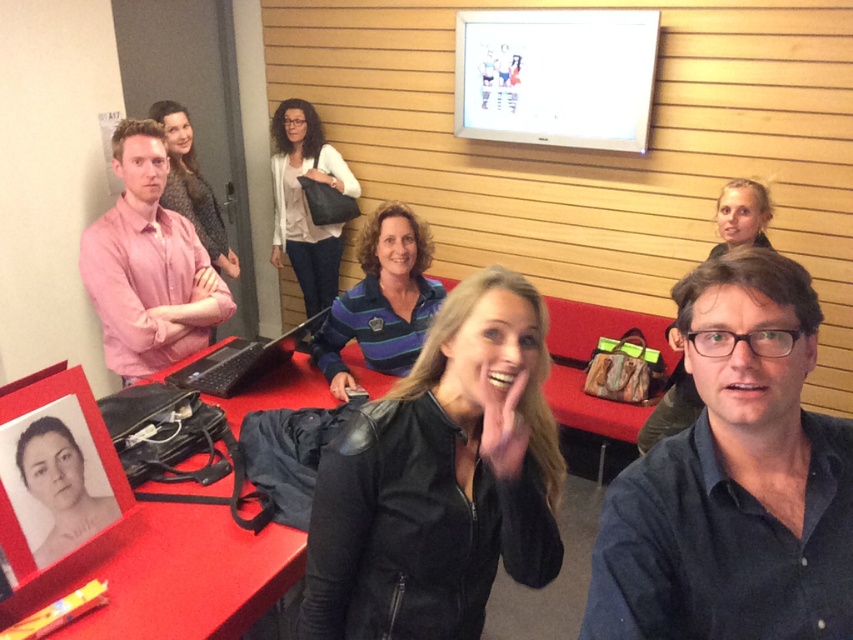
Does red leather table at center appear under matte pink sweater at center?

Yes, red leather table at center is below matte pink sweater at center.

Consider the image. Can you confirm if red leather table at center is wider than matte pink sweater at center?

Yes, red leather table at center is wider than matte pink sweater at center.

This screenshot has width=853, height=640. Identify the location of red leather table at center. (171, 576).

Is point (718, 216) farther from viewer compared to point (746, 196)?

Yes, it is behind point (746, 196).

Can you confirm if matte black jacket at upper right is thinner than smooth blonde hair at upper right?

No, matte black jacket at upper right is not thinner than smooth blonde hair at upper right.

Is point (740, 227) positioned behind point (766, 246)?

No, (740, 227) is closer to viewer.

Locate an element on the screen. The width and height of the screenshot is (853, 640). matte black jacket at upper right is located at coordinates (741, 216).

Can you confirm if dark blue shirt at center is wider than striped polo shirt at center?

Incorrect, dark blue shirt at center's width does not surpass striped polo shirt at center's.

Between dark blue shirt at center and striped polo shirt at center, which one has less height?

dark blue shirt at center

Is point (770, 412) positioned in front of point (390, 221)?

Yes, it is.

The height and width of the screenshot is (640, 853). Identify the location of dark blue shirt at center. (734, 480).